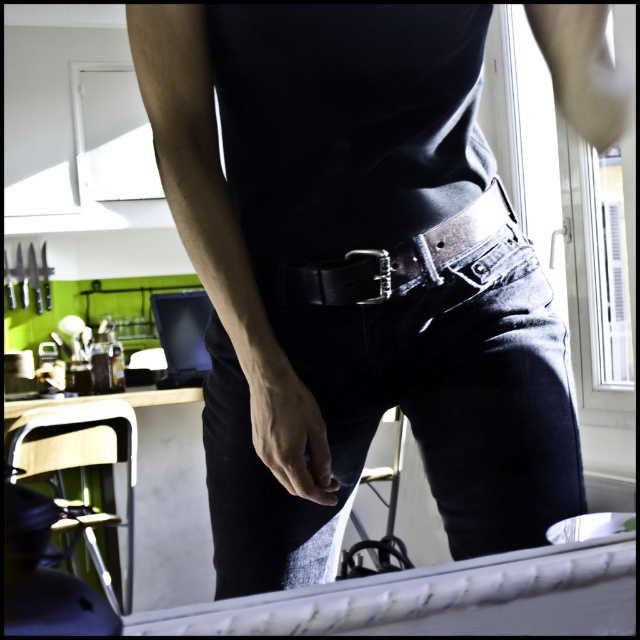
At what (x,y) coordinates should I click in order to perform the action: click on matte black belt at center. Please return your answer as a coordinate pair (x, y). The image size is (640, 640). Looking at the image, I should click on (340, 268).

Is matte black belt at center to the right of leather belt at center from the viewer's perspective?

In fact, matte black belt at center is to the left of leather belt at center.

Between point (266, 577) and point (301, 278), which one is positioned in front?

Point (301, 278)

You are a GUI agent. You are given a task and a screenshot of the screen. Output one action in this format:
    pyautogui.click(x=<x>, y=<y>)
    Task: Click on the matte black belt at center
    The width and height of the screenshot is (640, 640).
    Given the screenshot: What is the action you would take?
    [x=340, y=268]

Can you confirm if leather belt at center is positioned to the left of metallic silver belt buckle at center?

In fact, leather belt at center is to the right of metallic silver belt buckle at center.

Based on the photo, which is more to the right, leather belt at center or metallic silver belt buckle at center?

Positioned to the right is leather belt at center.

Is point (308, 288) closer to camera compared to point (380, 296)?

No, (308, 288) is behind (380, 296).

The image size is (640, 640). What are the coordinates of `leather belt at center` in the screenshot? It's located at (385, 260).

Can you confirm if denim at center is positioned to the right of leather belt at center?

In fact, denim at center is to the left of leather belt at center.

Does denim at center have a lesser width compared to leather belt at center?

Incorrect, denim at center's width is not less than leather belt at center's.

Is point (227, 573) closer to viewer compared to point (285, 292)?

No, it is behind (285, 292).

Where is `denim at center`? denim at center is located at coordinates (404, 413).